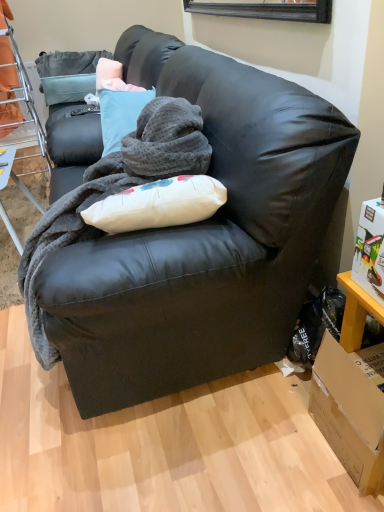
Question: Looking at the image, does matte black couch at center seem bigger or smaller compared to brown cardboard box at lower right?

Choices:
 (A) small
 (B) big

Answer: (B)

Question: In the image, is matte black couch at center on the left side or the right side of brown cardboard box at lower right?

Choices:
 (A) left
 (B) right

Answer: (A)

Question: Which is nearer to the orange fabric bunk bed at left?

Choices:
 (A) brown cardboard box at lower right
 (B) metal mesh table at lower left
 (C) matte black couch at center
 (D) soft gray fleece blanket at center

Answer: (B)

Question: Considering the real-world distances, which object is closest to the brown cardboard box at lower right?

Choices:
 (A) matte black couch at center
 (B) metal mesh table at lower left
 (C) soft gray fleece blanket at center
 (D) orange fabric bunk bed at left

Answer: (A)